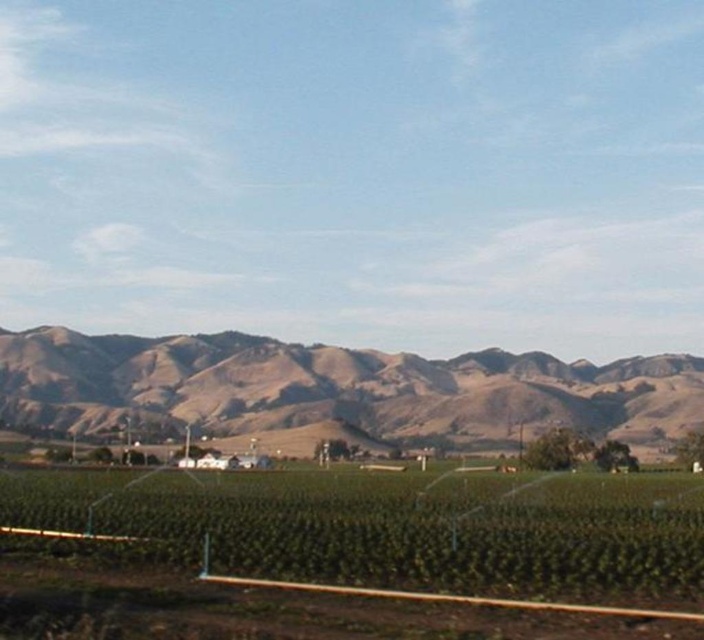
Question: In this image, where is green grass at center located relative to brown/dry grassy hillside at center?

Choices:
 (A) right
 (B) left

Answer: (B)

Question: Which object is closer to the camera taking this photo?

Choices:
 (A) green grass at center
 (B) brown/dry grassy hillside at center

Answer: (A)

Question: Does green grass at center appear under brown/dry grassy hillside at center?

Choices:
 (A) no
 (B) yes

Answer: (A)

Question: From the image, what is the correct spatial relationship of green grass at center in relation to brown/dry grassy hillside at center?

Choices:
 (A) above
 (B) below

Answer: (A)